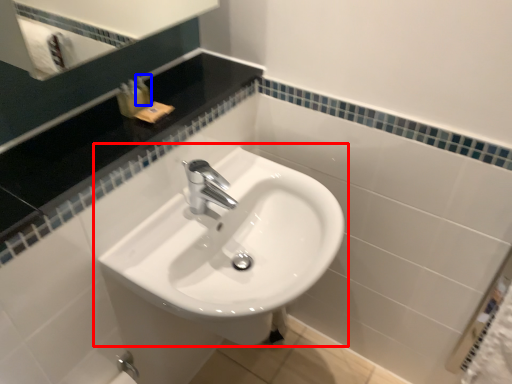
Question: Which object is further to the camera taking this photo, sink (highlighted by a red box) or toiletry (highlighted by a blue box)?

Choices:
 (A) sink
 (B) toiletry

Answer: (B)